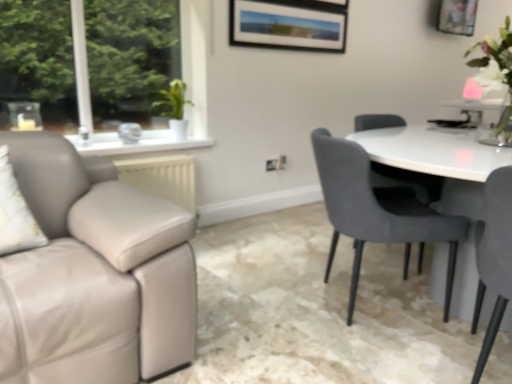
Question: Does white glossy vase at upper right have a greater height compared to velvet grey chair at right, which is the 2th chair from front to back?

Choices:
 (A) no
 (B) yes

Answer: (A)

Question: Considering the relative sizes of white glossy vase at upper right and velvet grey chair at right, which is the 2th chair from front to back, in the image provided, is white glossy vase at upper right wider than velvet grey chair at right, which is the 2th chair from front to back,?

Choices:
 (A) no
 (B) yes

Answer: (A)

Question: Is velvet grey chair at right, the 1th chair positioned from the back, surrounded by white glossy vase at upper right?

Choices:
 (A) no
 (B) yes

Answer: (A)

Question: Is white glossy vase at upper right shorter than velvet grey chair at right, the 1th chair positioned from the back?

Choices:
 (A) yes
 (B) no

Answer: (A)

Question: Is white glossy vase at upper right positioned behind velvet grey chair at right, which is the 2th chair from front to back?

Choices:
 (A) no
 (B) yes

Answer: (B)

Question: Is point (470, 31) closer or farther from the camera than point (480, 266)?

Choices:
 (A) closer
 (B) farther

Answer: (B)

Question: Is wooden picture frame at upper right wider or thinner than matte gray chair at right, the second chair viewed from the back?

Choices:
 (A) thin
 (B) wide

Answer: (A)

Question: In terms of height, does wooden picture frame at upper right look taller or shorter compared to matte gray chair at right, which is the first chair from front to back?

Choices:
 (A) short
 (B) tall

Answer: (A)

Question: Based on their sizes in the image, would you say wooden picture frame at upper right is bigger or smaller than matte gray chair at right, the second chair viewed from the back?

Choices:
 (A) small
 (B) big

Answer: (A)

Question: Is velvet grey chair at right, which is the 2th chair from front to back, situated inside white glossy vase at upper right or outside?

Choices:
 (A) outside
 (B) inside

Answer: (A)

Question: In terms of height, does velvet grey chair at right, the 1th chair positioned from the back, look taller or shorter compared to white glossy vase at upper right?

Choices:
 (A) short
 (B) tall

Answer: (B)

Question: Based on their positions, is velvet grey chair at right, which is the 2th chair from front to back, located to the left or right of white glossy vase at upper right?

Choices:
 (A) right
 (B) left

Answer: (B)

Question: Is point (349, 147) positioned closer to the camera than point (505, 109)?

Choices:
 (A) farther
 (B) closer

Answer: (B)

Question: Would you say velvet grey chair at right, the 1th chair positioned from the back, is to the left or to the right of wooden picture frame at upper right in the picture?

Choices:
 (A) right
 (B) left

Answer: (B)

Question: Relative to wooden picture frame at upper right, is velvet grey chair at right, which is the 2th chair from front to back, in front or behind?

Choices:
 (A) behind
 (B) front

Answer: (B)